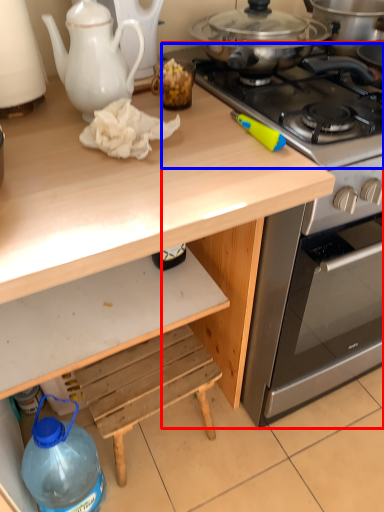
Question: Which point is closer to the camera, oven (highlighted by a red box) or gas stove (highlighted by a blue box)?

Choices:
 (A) oven
 (B) gas stove

Answer: (B)